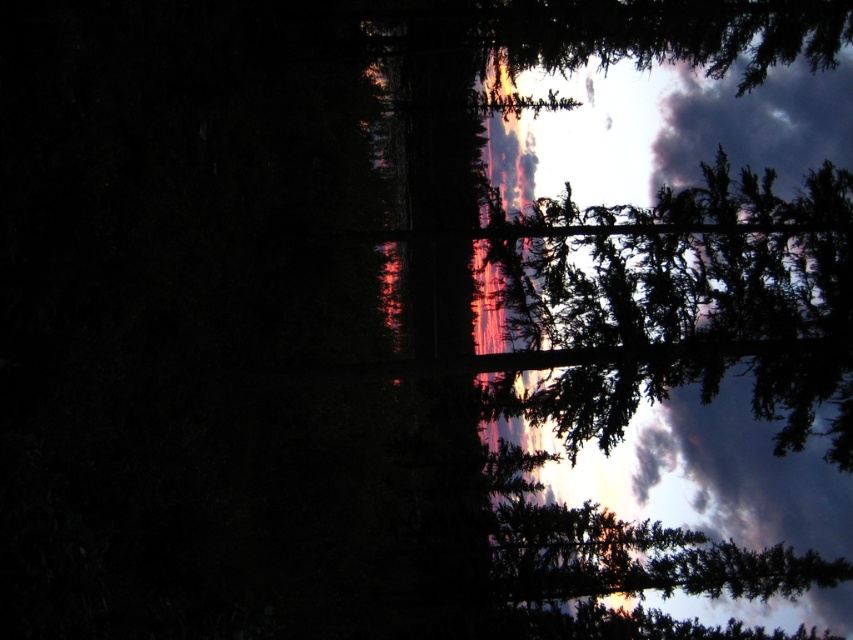
Question: Does green textured tree at upper right lie in front of green matte tree at upper center?

Choices:
 (A) no
 (B) yes

Answer: (B)

Question: Can you confirm if green textured tree at upper right is positioned to the right of green matte tree at upper center?

Choices:
 (A) no
 (B) yes

Answer: (B)

Question: Which object is closer to the camera taking this photo?

Choices:
 (A) green textured tree at upper right
 (B) green matte tree at upper center

Answer: (A)

Question: Which point is closer to the camera?

Choices:
 (A) green textured tree at upper right
 (B) green matte tree at upper center

Answer: (A)

Question: From the image, what is the correct spatial relationship of green textured tree at upper right in relation to green matte tree at upper center?

Choices:
 (A) below
 (B) above

Answer: (A)